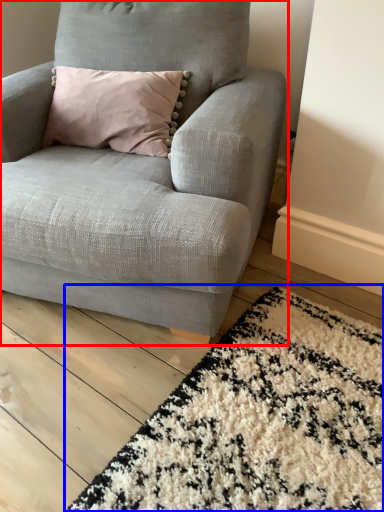
Question: Which of the following is the closest to the observer, chair (highlighted by a red box) or mat (highlighted by a blue box)?

Choices:
 (A) chair
 (B) mat

Answer: (B)